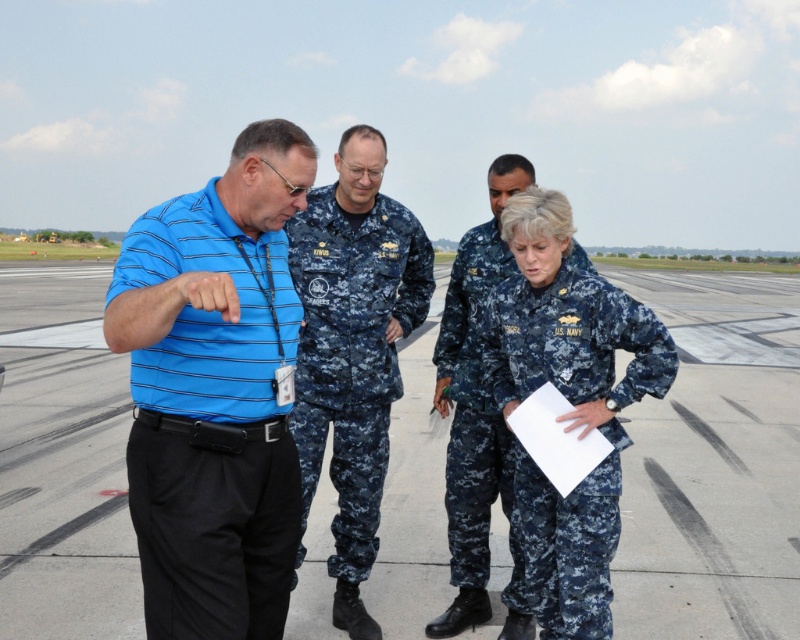
Question: From the image, what is the correct spatial relationship of matte blue uniform at center in relation to navy blue uniform at center?

Choices:
 (A) above
 (B) below

Answer: (A)

Question: Among these objects, which one is nearest to the camera?

Choices:
 (A) navy blue uniform at center
 (B) blue striped polo shirt at left
 (C) matte blue uniform at center

Answer: (B)

Question: Which point appears closest to the camera in this image?

Choices:
 (A) (130, 525)
 (B) (322, 438)
 (C) (552, 300)

Answer: (C)

Question: Is blue striped polo shirt at left above dull blue camouflage uniform at center?

Choices:
 (A) yes
 (B) no

Answer: (A)

Question: Is dull blue camouflage uniform at center wider than digital camouflage uniform at center?

Choices:
 (A) yes
 (B) no

Answer: (B)

Question: Which point appears closest to the camera in this image?

Choices:
 (A) (62, 380)
 (B) (594, 518)

Answer: (B)